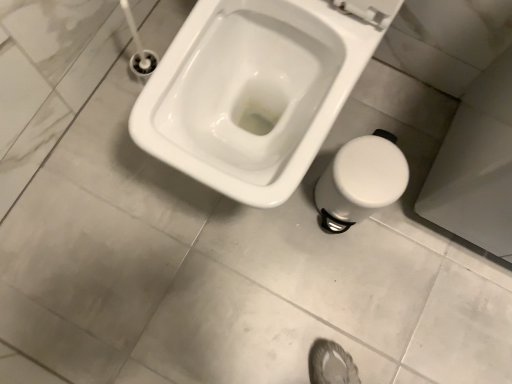
Where is `free space in front of white plastic bidet at lower right`? The image size is (512, 384). free space in front of white plastic bidet at lower right is located at coordinates (330, 267).